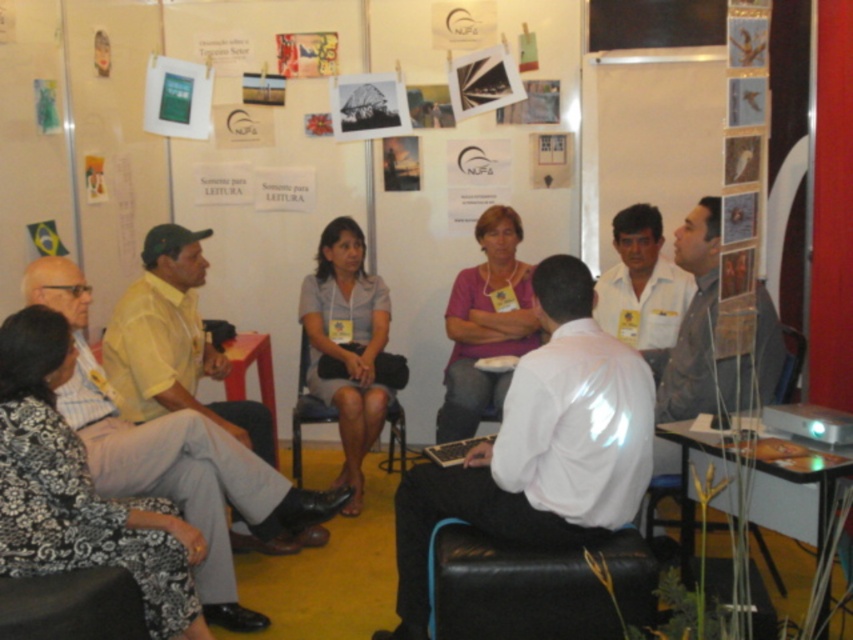
You are a photographer trying to capture a group photo of the people in the scene. You want to ensure that both the pink fabric shirt at center and the white shirt at center are clearly visible in the frame. Given their heights, which shirt should you adjust your camera angle to focus on to ensure both are in focus?

The pink fabric shirt at center is taller than the white shirt at center. To ensure both are in focus, adjust the camera angle to focus on the pink fabric shirt at center first, as its greater height will require proper framing, and the white shirt at center will naturally fall into the same focal plane.

In the scene, where is the light yellow shirt at left located?

The light yellow shirt at left is located at point 0.714 on the x axis and 0.206 on the y axis.